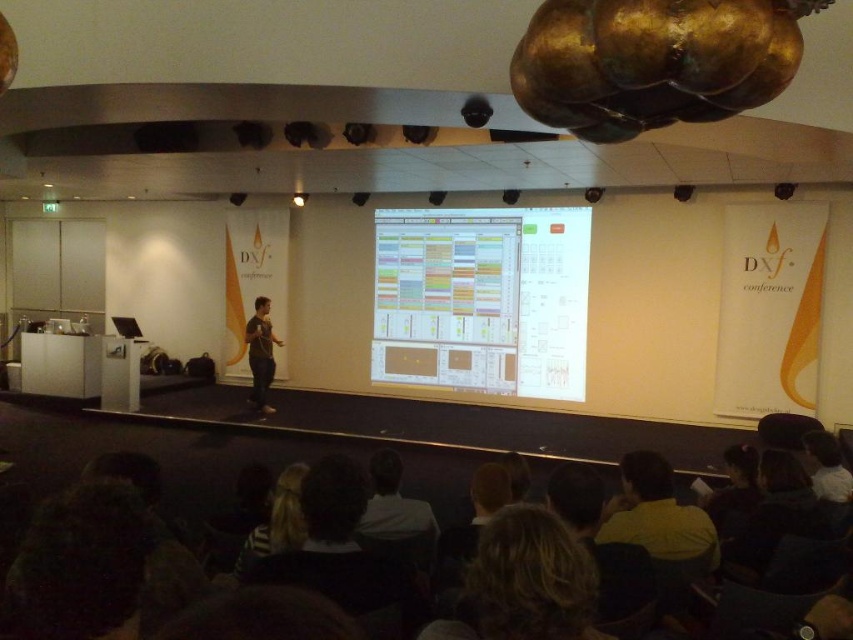
You are an attendee at the conference and want to take a photo of the white glossy projection screen at center and the yellow matte shirt at lower center. Which object should you focus on first if you want to capture both in the same frame without moving the camera?

You should focus on the white glossy projection screen at center first because it is to the left of the yellow matte shirt at lower center, so positioning the camera to include both would require framing from the left side where the screen is located towards the right where the shirt is positioned.

You are an event organizer setting up a conference room. You have a white glossy projection screen at center and a white shirt at center. Which object is wider?

The white glossy projection screen at center is wider than the white shirt at center.

You are an attendee at the conference and want to take a photo of the white glossy projection screen at center without any obstructions. Is the yellow matte shirt at lower center blocking your view of the screen?

The yellow matte shirt at lower center is behind the white glossy projection screen at center, so it is not blocking your view of the screen.